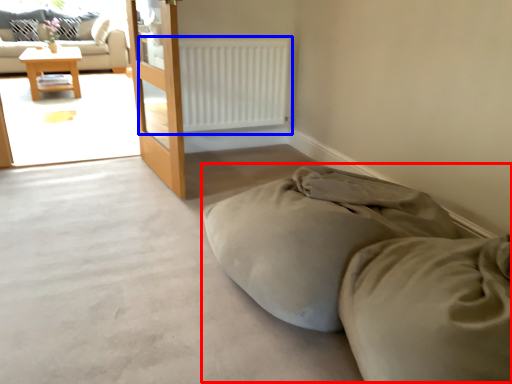
Question: Among these objects, which one is nearest to the camera, bed (highlighted by a red box) or radiator (highlighted by a blue box)?

Choices:
 (A) bed
 (B) radiator

Answer: (A)